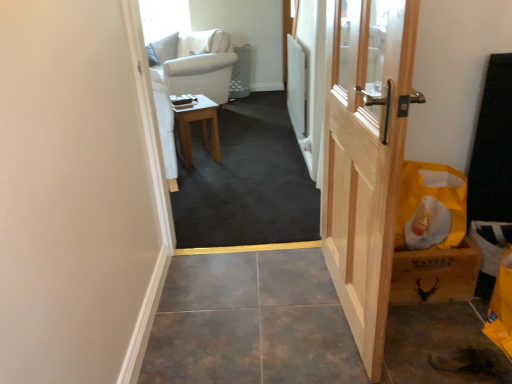
Question: In terms of width, does natural wood door at right look wider or thinner when compared to yellow paper bag at right?

Choices:
 (A) wide
 (B) thin

Answer: (B)

Question: Is point (373, 357) positioned closer to the camera than point (408, 258)?

Choices:
 (A) farther
 (B) closer

Answer: (B)

Question: Based on their relative distances, which object is nearer to the yellow paper bag at right?

Choices:
 (A) carpeted floor at center
 (B) natural wood door at right
 (C) wooden table at center

Answer: (B)

Question: Which of these objects is positioned closest to the natural wood door at right?

Choices:
 (A) carpeted floor at center
 (B) wooden table at center
 (C) yellow paper bag at right

Answer: (C)